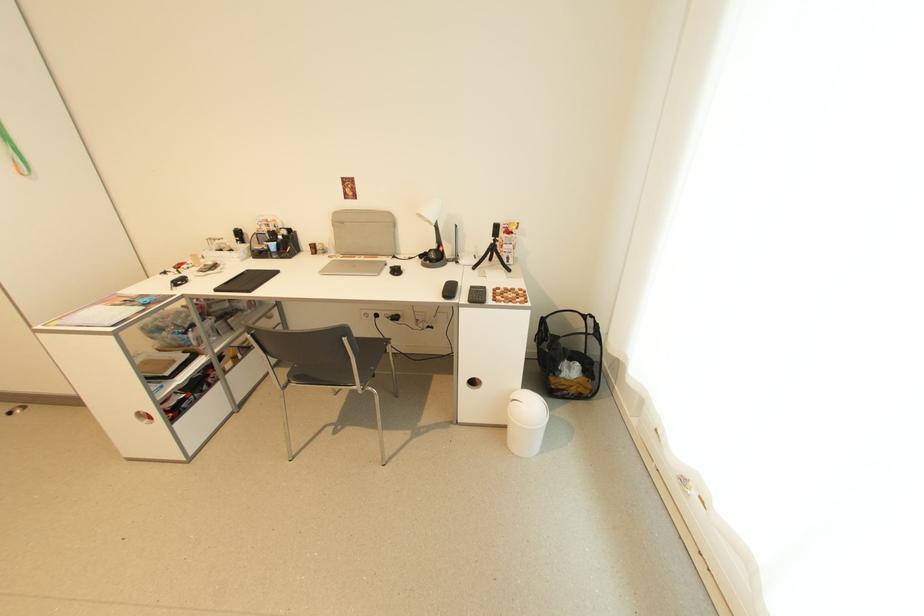
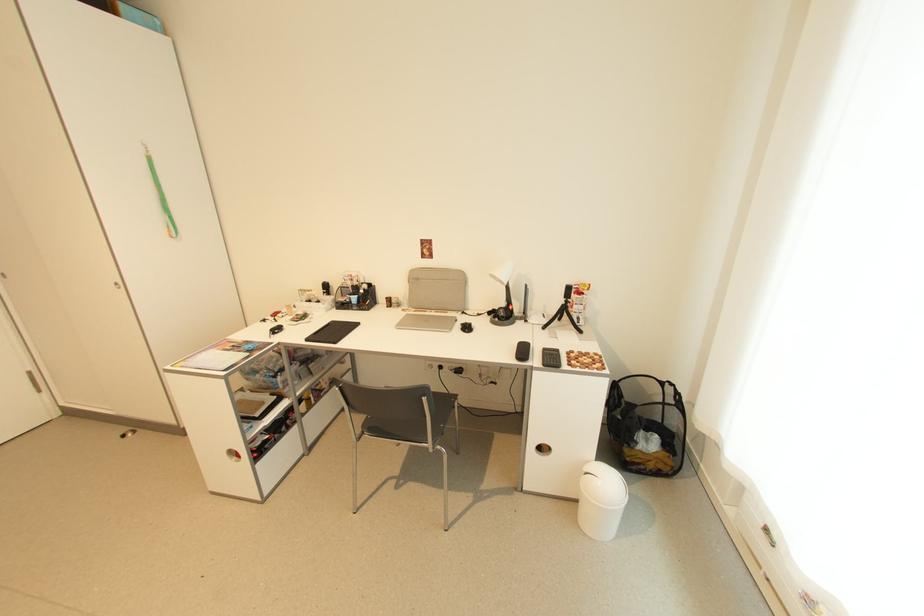
In the second image, find the point that corresponds to pixel 148 422 in the first image.

(237, 460)